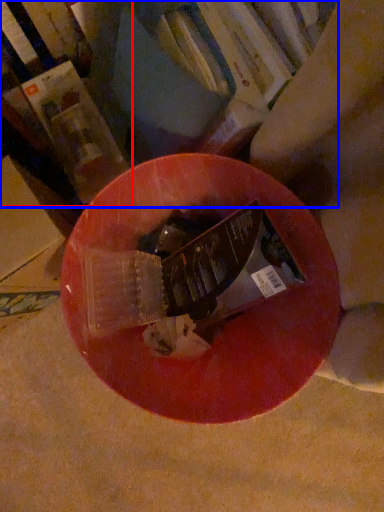
Question: Among these objects, which one is nearest to the camera, book (highlighted by a red box) or book (highlighted by a blue box)?

Choices:
 (A) book
 (B) book

Answer: (B)